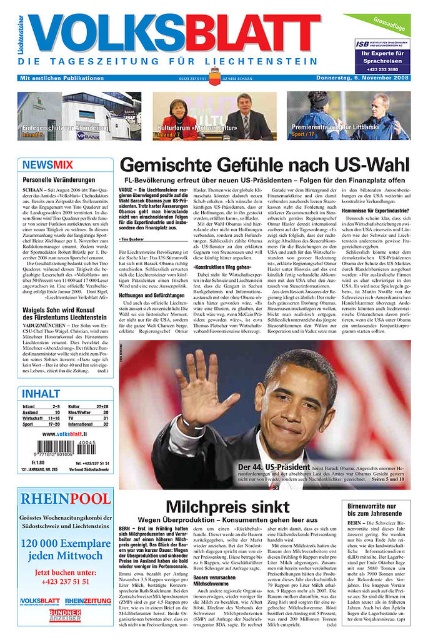
You are a fashion critic attending a political event in Liechtenstein. You notice two suits displayed on the front page of the Volksblatt newspaper. The dark gray suit at center and the matte black suit at center. Which suit is wider?

The dark gray suit at center is wider than the matte black suit at center.

You are a tailor who needs to place both the dark gray suit at center and the matte black suit at center onto a 20 inch wide rack. Can both suits fit side by side on the rack without overlapping?

The dark gray suit at center and matte black suit at center are 19.46 inches apart, so they can fit side by side on a 20 inch wide rack since the total width required is less than the rack width.

What is the position of the dark gray suit at center in the newspaper image?

The dark gray suit at center is positioned at point coordinates of 0.672 in the x axis and 0.582 in the y axis.